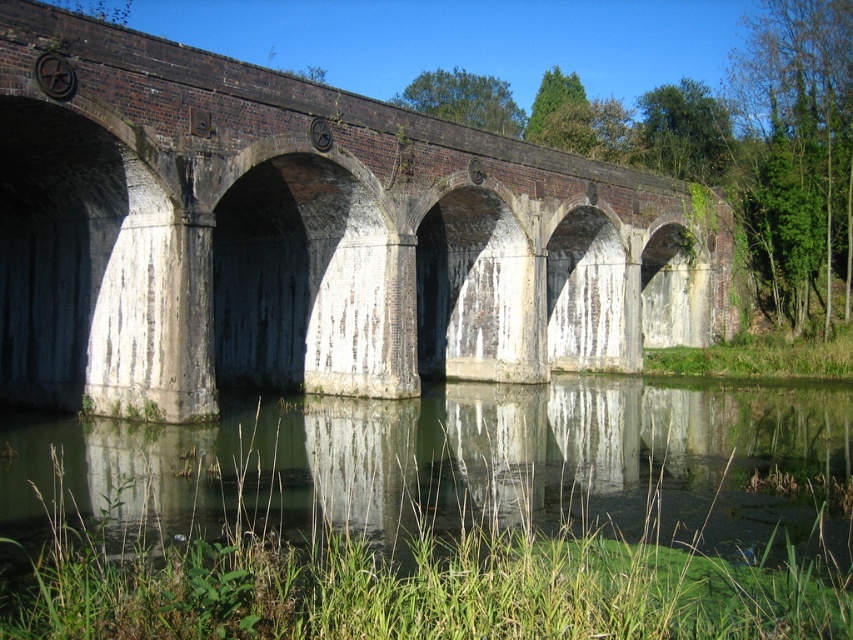
Is brick bridge at center thinner than green algae-covered water at lower center?

Incorrect, brick bridge at center's width is not less than green algae-covered water at lower center's.

How far apart are brick bridge at center and green algae-covered water at lower center?

They are 14.52 meters apart.

Which is behind, point (305, 208) or point (527, 461)?

The point (305, 208) is behind.

Where is `brick bridge at center`? This screenshot has height=640, width=853. brick bridge at center is located at coordinates pos(306,236).